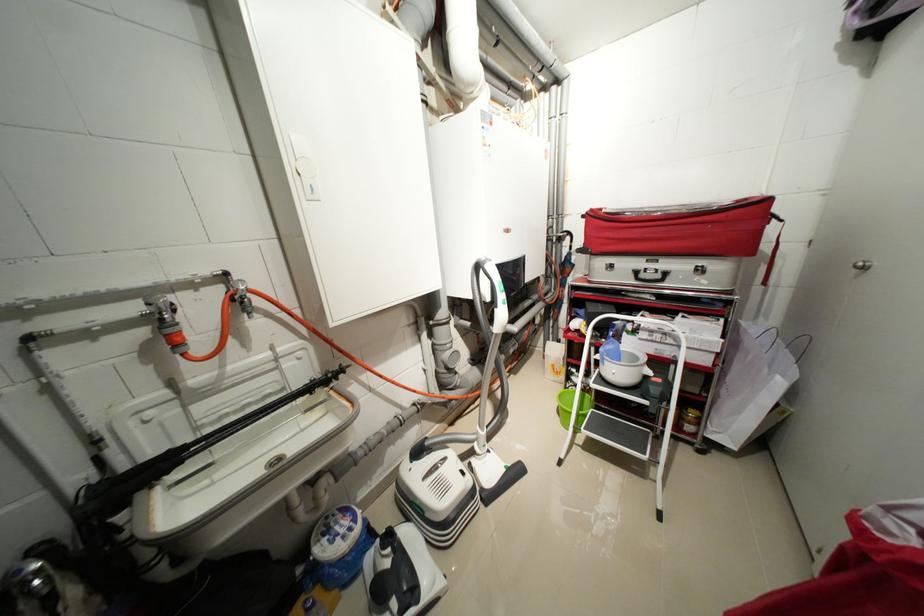
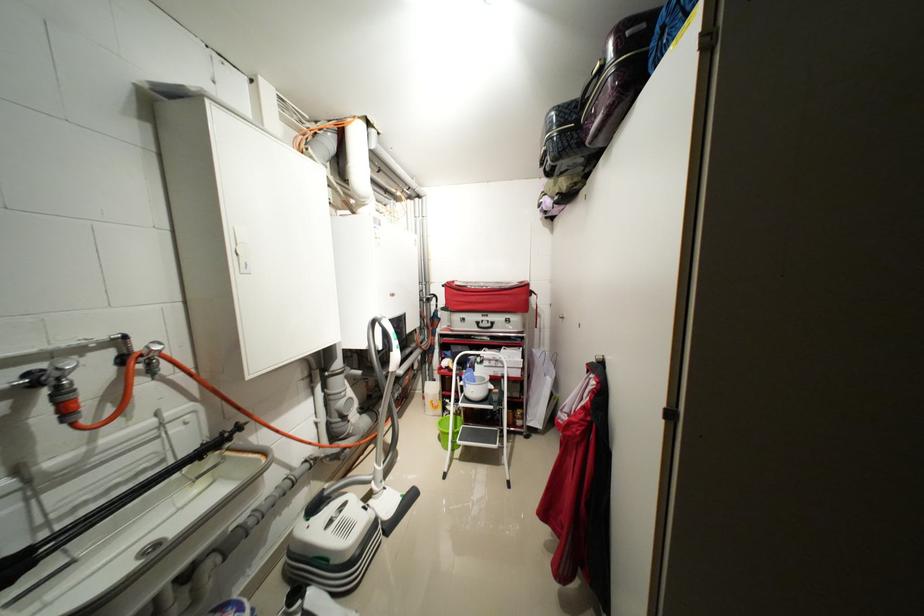
Locate, in the second image, the point that corresponds to point (659, 331) in the first image.

(496, 361)